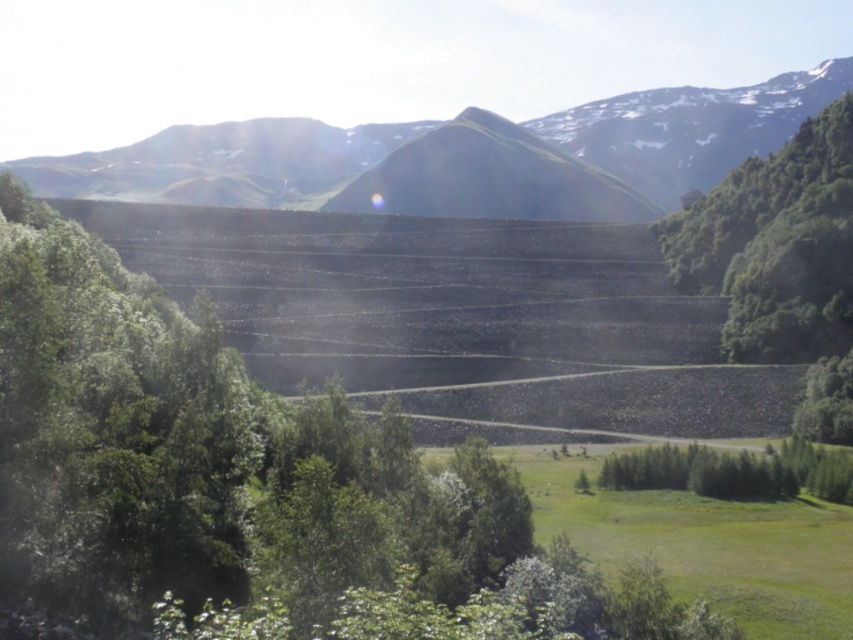
Question: Can you confirm if green grassy mountain at center is positioned to the left of green leafy tree at right?

Choices:
 (A) yes
 (B) no

Answer: (A)

Question: Estimate the real-world distances between objects in this image. Which object is farther from the green grassy mountain at center?

Choices:
 (A) green grassy hill at center
 (B) green leafy tree at right

Answer: (B)

Question: Which point is closer to the camera taking this photo?

Choices:
 (A) (283, 128)
 (B) (701, 257)
 (C) (381, 189)

Answer: (B)

Question: Is green leafy tree at right to the right of green grassy hill at center from the viewer's perspective?

Choices:
 (A) yes
 (B) no

Answer: (A)

Question: Where is green grassy mountain at center located in relation to green grassy hill at center in the image?

Choices:
 (A) left
 (B) right

Answer: (B)

Question: Which point is farther from the camera taking this photo?

Choices:
 (A) (368, 208)
 (B) (651, 168)
 (C) (741, 332)

Answer: (B)